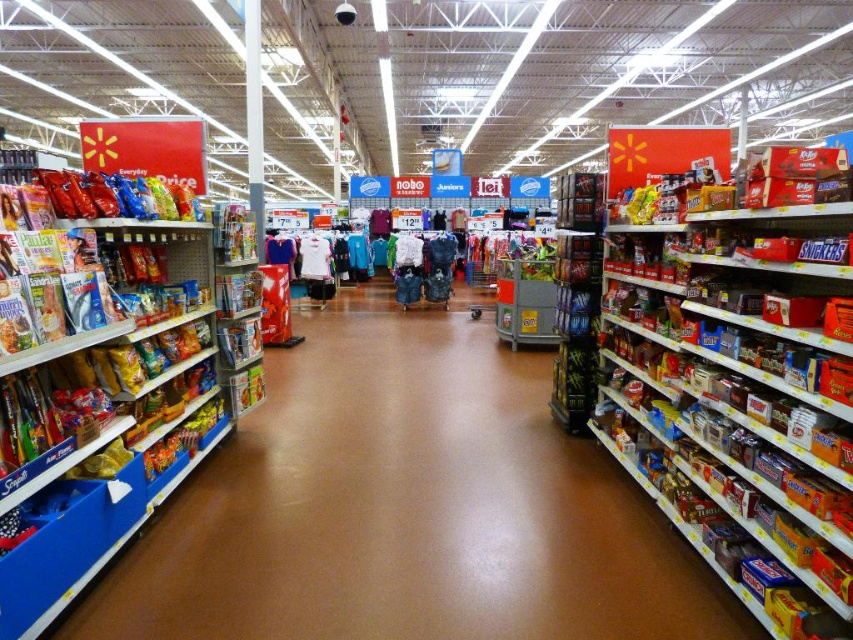
You are a store employee who needs to place a new matte plastic snack at left on a shelf that is 4.5 meters away from the entrance. The entrance is located at the end of the aisle. Can you place the snack at the designated spot without moving any existing items?

The matte plastic snack at left is currently 4.65 meters away from the entrance, which is slightly further than the required 4.5 meters. Therefore, you would need to move it closer to the entrance by 15 centimeters to meet the designated placement.

You are a customer in Walmart and want to buy the matte plastic snack at left. Where exactly should you look in the aisle?

The matte plastic snack at left is located at point (x=405, y=508) in the aisle.

You are standing in the Walmart aisle and want to pick up an item. You see two points marked in the scene. Which point is closer to you, the customer, when you are facing the aisle? The points are point (x=368, y=403) and point (x=633, y=419).

Point (x=368, y=403) is closer to you because it is further to the camera than point (x=633, y=419), meaning it is nearer in the scene.